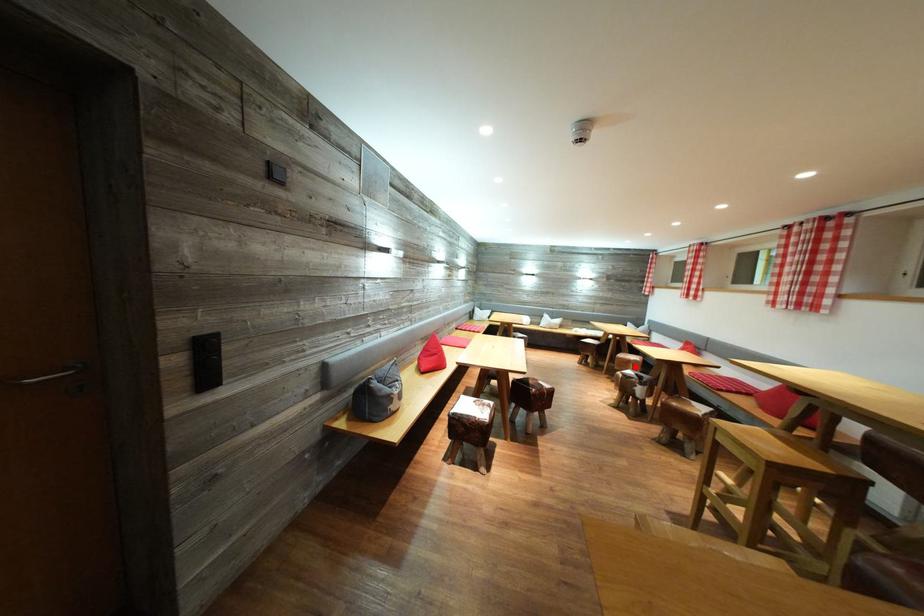
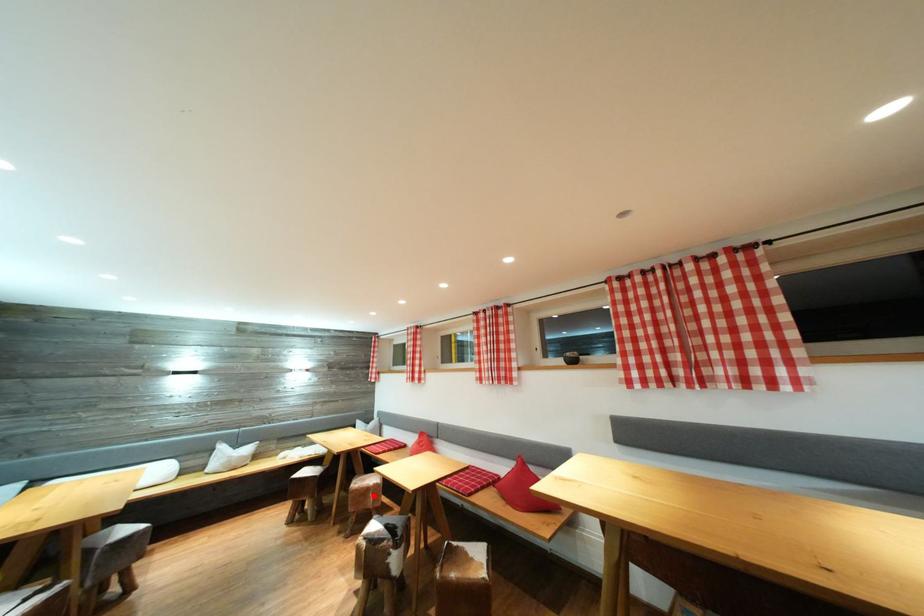
I am providing you with two images of the same scene from different viewpoints. A red point is marked on the first image and another point is marked on the second image. Does the point marked in image1 correspond to the same location as the one in image2?

Yes